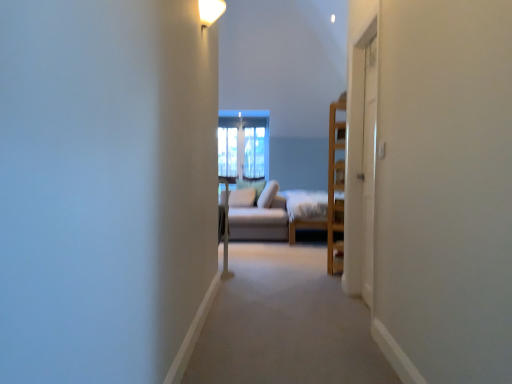
Question: From a real-world perspective, is clear glass window at center positioned above or below white glossy light fixture at upper center?

Choices:
 (A) below
 (B) above

Answer: (A)

Question: In terms of size, does clear glass window at center appear bigger or smaller than white glossy light fixture at upper center?

Choices:
 (A) small
 (B) big

Answer: (B)

Question: Which is farther from the white wood screen door at right, which is the second screen door in left-to-right order?

Choices:
 (A) light brown wooden bed frame at center
 (B) clear glass window at center
 (C) white wooden screen door at right, which ranks as the 2th screen door in right-to-left order
 (D) white glossy light fixture at upper center
 (E) beige fabric couch at center

Answer: (B)

Question: Based on their relative distances, which object is farther from the white wooden screen door at right, the 1th screen door viewed from the left?

Choices:
 (A) light brown wooden bed frame at center
 (B) clear glass window at center
 (C) beige fabric couch at center
 (D) white wood screen door at right, which is the second screen door in left-to-right order
 (E) white glossy light fixture at upper center

Answer: (B)